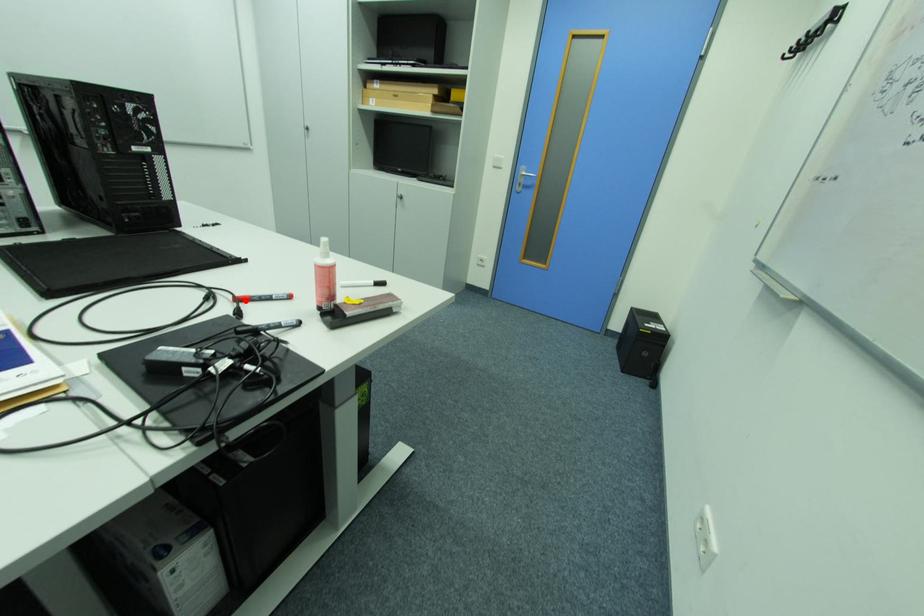
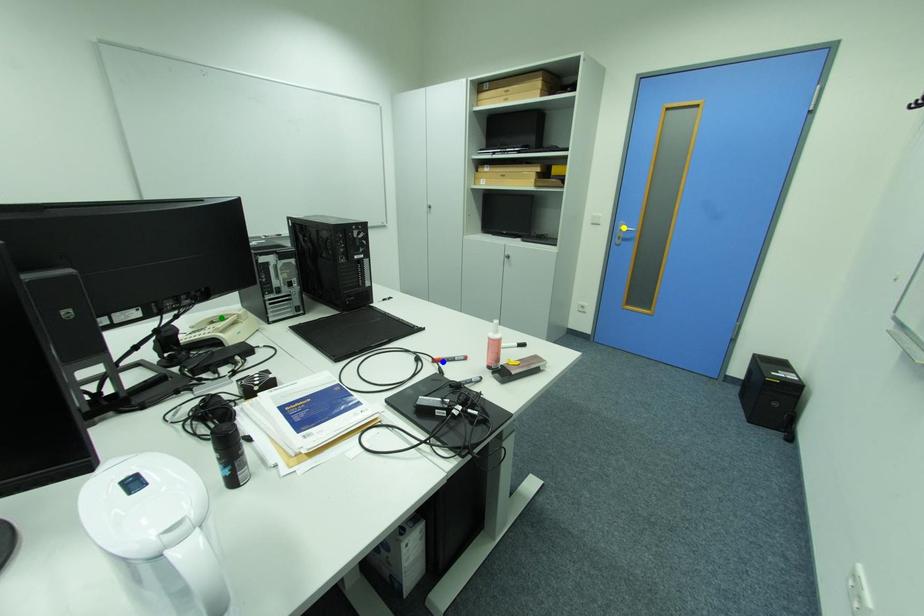
Question: I am providing you with two images of the same scene from different viewpoints. A red point is marked on the first image. You are given multiple points on the second image. Which point in image 2 is actually the same real-world point as the red point in image 1?

Choices:
 (A) green point
 (B) yellow point
 (C) blue point

Answer: (C)